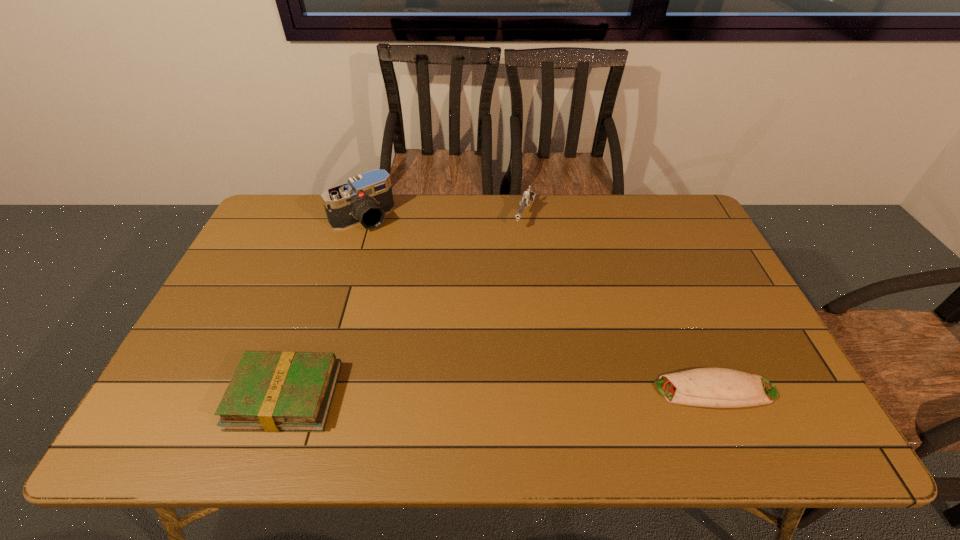
At what (x,y) coordinates should I click in order to perform the action: click on free space located 0.350m on the front-facing side of the tallest object. Please return your answer as a coordinate pair (x, y). Looking at the image, I should click on (429, 297).

Where is `free space located on the front-facing side of the tallest object`? The height and width of the screenshot is (540, 960). free space located on the front-facing side of the tallest object is located at coordinates (391, 251).

At what (x,y) coordinates should I click in order to perform the action: click on vacant space located on the front-facing side of the tallest object. Please return your answer as a coordinate pair (x, y). The image size is (960, 540). Looking at the image, I should click on (438, 308).

I want to click on vacant space positioned 0.200m aimed along the barrel of the gun, so click(506, 271).

Image resolution: width=960 pixels, height=540 pixels. What are the coordinates of `vacant space located aimed along the barrel of the gun` in the screenshot? It's located at (505, 273).

Identify the location of blank area located aimed along the barrel of the gun. (497, 292).

Where is `camera that is at the far edge`? camera that is at the far edge is located at coordinates (366, 198).

This screenshot has height=540, width=960. I want to click on gun at the far edge, so click(x=528, y=196).

This screenshot has height=540, width=960. I want to click on book that is at the near edge, so click(x=288, y=391).

This screenshot has height=540, width=960. What are the coordinates of `burrito that is at the near edge` in the screenshot? It's located at (704, 387).